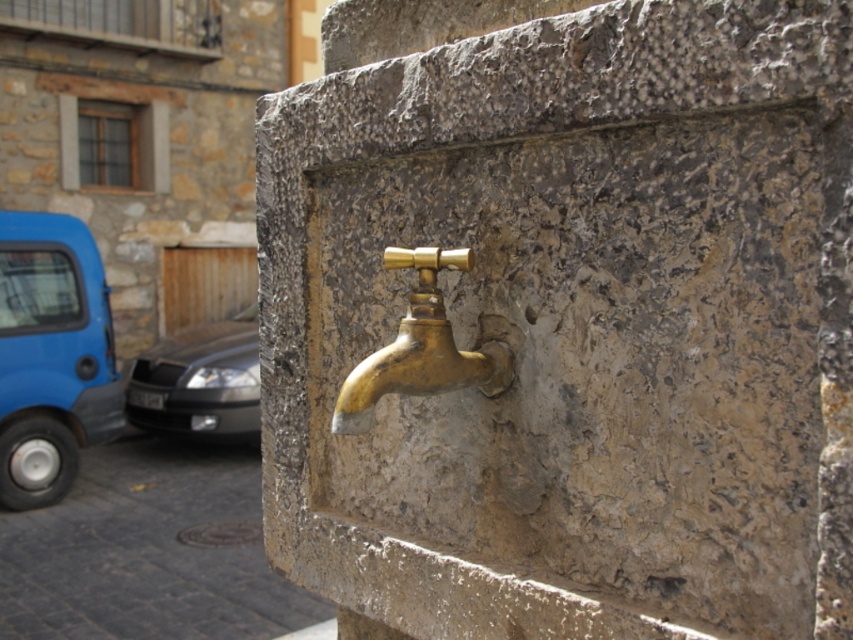
At what (x,y) coordinates should I click in order to perform the action: click on blue rubber car at left. Please return your answer as a coordinate pair (x, y). The height and width of the screenshot is (640, 853). Looking at the image, I should click on (51, 355).

Can you confirm if gold brass faucet at center is positioned below silver metallic car at left?

No.

Measure the distance between point (457, 378) and camera.

Point (457, 378) is 98.36 centimeters away from camera.

The width and height of the screenshot is (853, 640). I want to click on gold brass faucet at center, so click(x=421, y=348).

Consider the image. Between gold-bronze faucet at center and gold brass faucet at center, which one is positioned higher?

Positioned higher is gold brass faucet at center.

Does gold-bronze faucet at center have a lesser width compared to gold brass faucet at center?

Incorrect, gold-bronze faucet at center's width is not less than gold brass faucet at center's.

The image size is (853, 640). I want to click on gold-bronze faucet at center, so click(x=566, y=317).